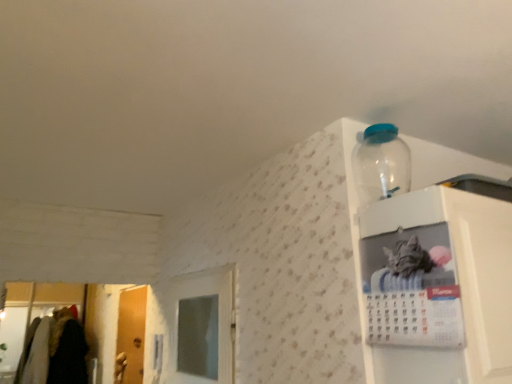
Question: Does white glossy calendar at upper right, the first cabinet from the right, appear on the right side of wooden door at left?

Choices:
 (A) no
 (B) yes

Answer: (B)

Question: Considering the relative sizes of white glossy calendar at upper right, the first cabinet from the right, and wooden door at left in the image provided, is white glossy calendar at upper right, the first cabinet from the right, taller than wooden door at left?

Choices:
 (A) yes
 (B) no

Answer: (B)

Question: Does white glossy calendar at upper right, the first cabinet from the right, have a lesser height compared to wooden door at left?

Choices:
 (A) no
 (B) yes

Answer: (B)

Question: Is white glossy calendar at upper right, the first cabinet from the right, not within wooden door at left?

Choices:
 (A) no
 (B) yes

Answer: (B)

Question: Considering the relative sizes of white glossy calendar at upper right, the first cabinet from the right, and wooden door at left in the image provided, is white glossy calendar at upper right, the first cabinet from the right, bigger than wooden door at left?

Choices:
 (A) no
 (B) yes

Answer: (B)

Question: Considering their positions, is wooden door at left located in front of or behind white glossy calendar at upper right, the first cabinet from the right?

Choices:
 (A) front
 (B) behind

Answer: (B)

Question: Choose the correct answer: Is wooden door at left inside white glossy calendar at upper right, which is the second cabinet from left to right, or outside it?

Choices:
 (A) inside
 (B) outside

Answer: (B)

Question: Considering the positions of wooden door at left and white glossy calendar at upper right, which is the second cabinet from left to right, in the image, is wooden door at left bigger or smaller than white glossy calendar at upper right, which is the second cabinet from left to right,?

Choices:
 (A) small
 (B) big

Answer: (A)

Question: Is wooden door at left taller or shorter than white glossy calendar at upper right, which is the second cabinet from left to right?

Choices:
 (A) short
 (B) tall

Answer: (B)

Question: Based on their positions, is white glossy calendar at upper right, which is the second cabinet from right to left, located to the left or right of white glossy calendar at upper right, which is the second cabinet from left to right?

Choices:
 (A) left
 (B) right

Answer: (A)

Question: Relative to white glossy calendar at upper right, which is the second cabinet from left to right, is white glossy calendar at upper right, which is the second cabinet from right to left, in front or behind?

Choices:
 (A) behind
 (B) front

Answer: (A)

Question: Looking at their shapes, would you say white glossy calendar at upper right, which is the second cabinet from right to left, is wider or thinner than white glossy calendar at upper right, the first cabinet from the right?

Choices:
 (A) thin
 (B) wide

Answer: (A)

Question: Does point (385, 296) appear closer or farther from the camera than point (434, 218)?

Choices:
 (A) closer
 (B) farther

Answer: (B)

Question: Is white glossy calendar at upper right, the first cabinet from the right, bigger or smaller than white glossy calendar at upper right, which is the second cabinet from right to left?

Choices:
 (A) small
 (B) big

Answer: (B)

Question: Considering the positions of white glossy calendar at upper right, which is the second cabinet from left to right, and white glossy calendar at upper right, the 1th cabinet in the left-to-right sequence, in the image, is white glossy calendar at upper right, which is the second cabinet from left to right, wider or thinner than white glossy calendar at upper right, the 1th cabinet in the left-to-right sequence,?

Choices:
 (A) wide
 (B) thin

Answer: (A)